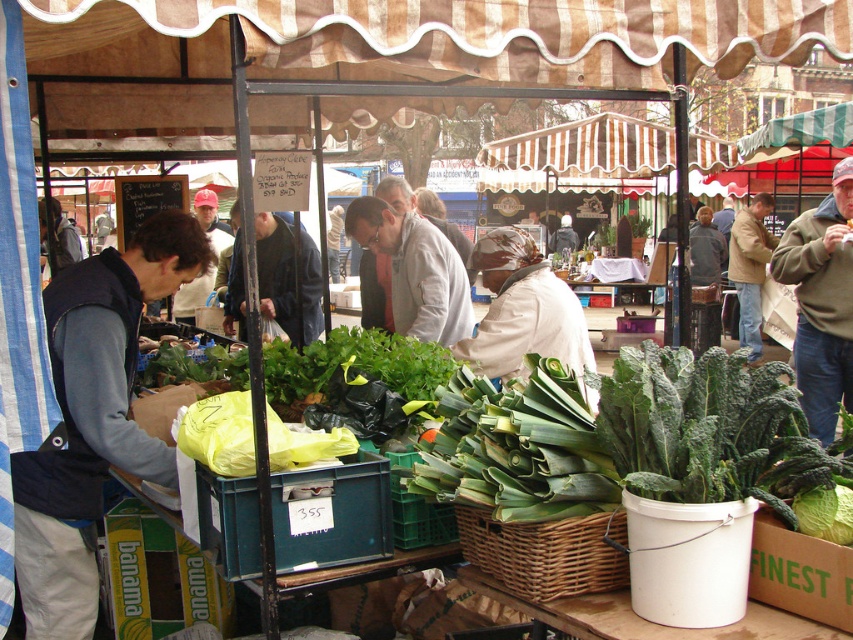
You are a customer at the market and want to carry both the dark blue jacket at left and the woven brown basket at lower center. Which item will take up more space in your shopping bag?

The dark blue jacket at left is bigger than the woven brown basket at lower center, so it will take up more space in your shopping bag.

You are a customer at the market and you want to pick up the woven brown basket at lower center. Which direction should you move to reach it from the dark blue jacket at left?

The dark blue jacket at left is positioned on the left side of the woven brown basket at lower center, so you should move to the right to reach the woven brown basket at lower center from the dark blue jacket at left.

You are a customer at the market and want to reach the person wearing the matte red cap at upper left to ask about the price of the greens. Which direction should you move relative to the green fuzzy sweater at right?

You should move towards the upper left direction from the green fuzzy sweater at right to reach the matte red cap at upper left, as the green fuzzy sweater at right is positioned under the matte red cap at upper left.